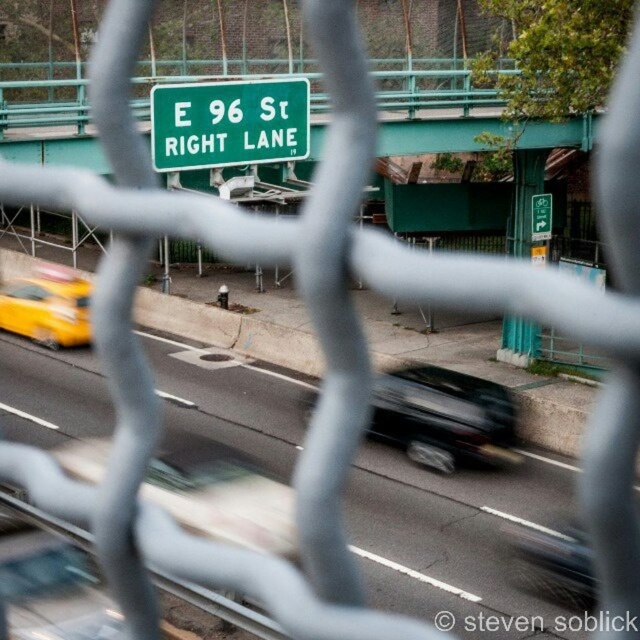
You are a pedestrian standing behind the fence looking at the street scene. You see the green matte sign at upper center and the yellow rubber taxi at left. Which object is positioned higher in the image?

The green matte sign at upper center is positioned higher than the yellow rubber taxi at left.